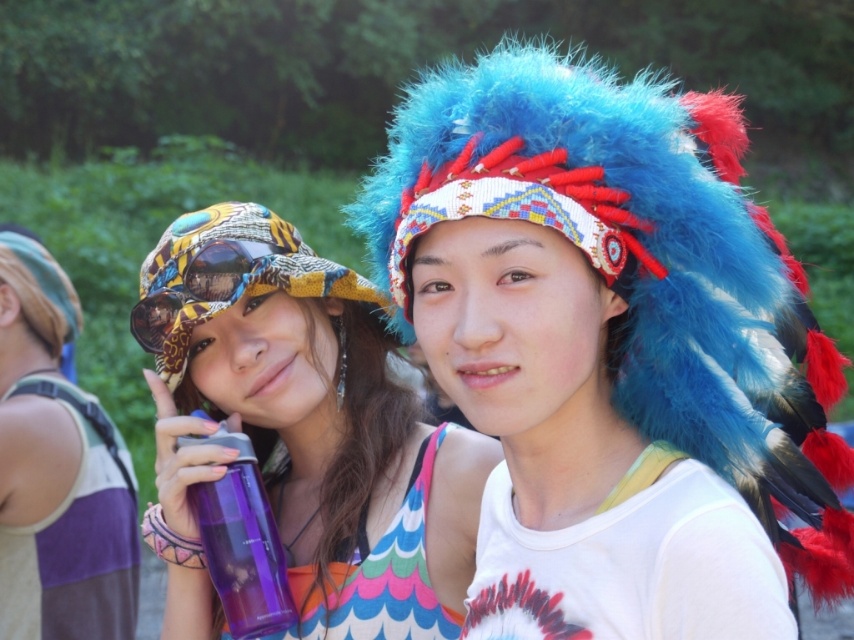
Who is shorter, fuzzy blue headdress at center or purple plastic water bottle at center?

Standing shorter between the two is purple plastic water bottle at center.

Based on the photo, does fuzzy blue headdress at center appear under purple plastic water bottle at center?

No.

Image resolution: width=854 pixels, height=640 pixels. What do you see at coordinates (640, 264) in the screenshot?
I see `fuzzy blue headdress at center` at bounding box center [640, 264].

The width and height of the screenshot is (854, 640). I want to click on fuzzy blue headdress at center, so click(x=640, y=264).

Can you confirm if fuzzy blue headdress at center is smaller than leopard print fabric goggles at left?

Incorrect, fuzzy blue headdress at center is not smaller in size than leopard print fabric goggles at left.

You are a GUI agent. You are given a task and a screenshot of the screen. Output one action in this format:
    pyautogui.click(x=<x>, y=<y>)
    Task: Click on the fuzzy blue headdress at center
    
    Given the screenshot: What is the action you would take?
    pyautogui.click(x=640, y=264)

Is printed fabric bucket hat at left bigger than leopard print fabric goggles at left?

Indeed, printed fabric bucket hat at left has a larger size compared to leopard print fabric goggles at left.

Who is more forward, [229,221] or [190,269]?

Point [190,269]

Does point (161, 340) lie in front of point (171, 291)?

No, (161, 340) is further to viewer.

Locate an element on the screen. The height and width of the screenshot is (640, 854). printed fabric bucket hat at left is located at coordinates (227, 275).